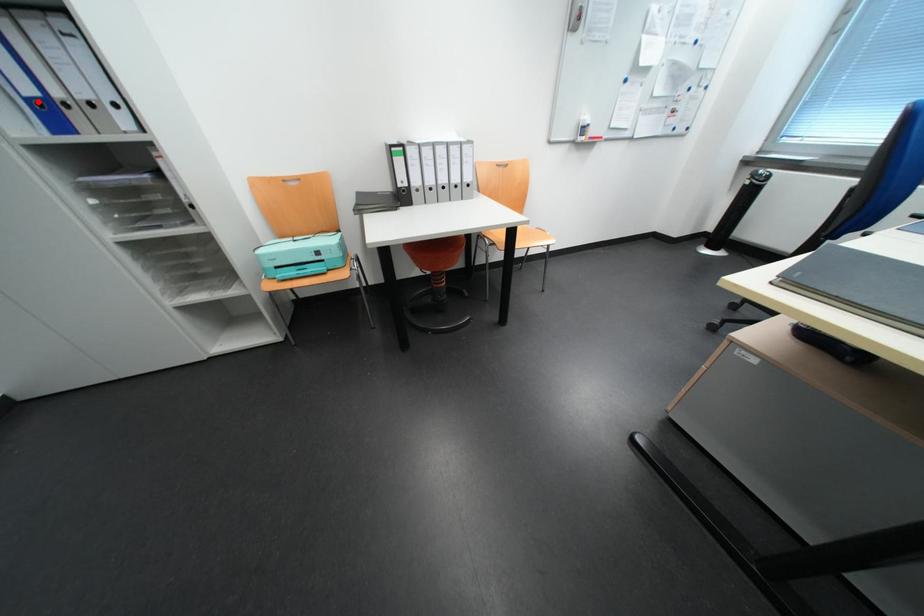
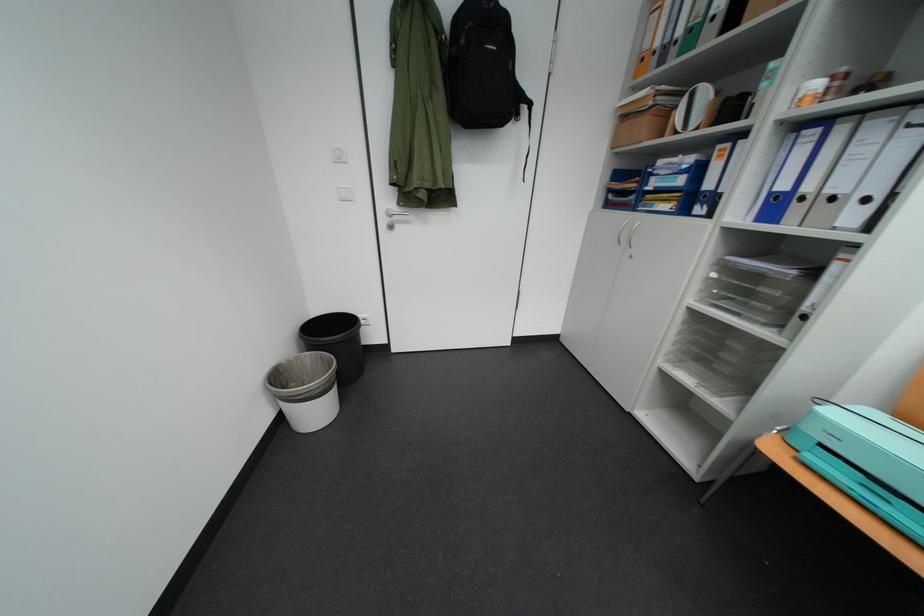
Question: I am providing you with two images of the same scene from different viewpoints. Given a red point in image1, look at the same physical point in image2. Is it:

Choices:
 (A) Closer to the viewpoint
 (B) Farther from the viewpoint

Answer: (A)